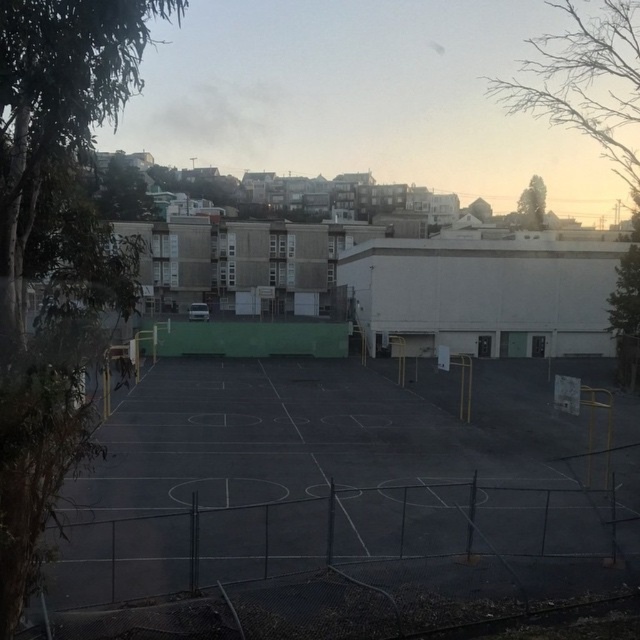
Question: Among these points, which one is farthest from the camera?

Choices:
 (A) (29, 156)
 (B) (541, 182)
 (C) (397, 444)

Answer: (B)

Question: Does black rubber basketball court at center have a greater width compared to green leafy tree at upper right?

Choices:
 (A) yes
 (B) no

Answer: (B)

Question: Can you confirm if green leafy tree at left is positioned to the right of green leafy tree at upper right?

Choices:
 (A) yes
 (B) no

Answer: (B)

Question: Which object is the closest to the black rubber basketball court at center?

Choices:
 (A) green leafy tree at upper right
 (B) green leafy tree at left
 (C) bare branches at upper right

Answer: (B)

Question: Which point is farther from the camera taking this photo?

Choices:
 (A) (3, 282)
 (B) (106, 586)
 (C) (628, 112)
 (D) (540, 224)

Answer: (C)

Question: In this image, where is bare branches at upper right located relative to green leafy tree at upper right?

Choices:
 (A) below
 (B) above

Answer: (B)